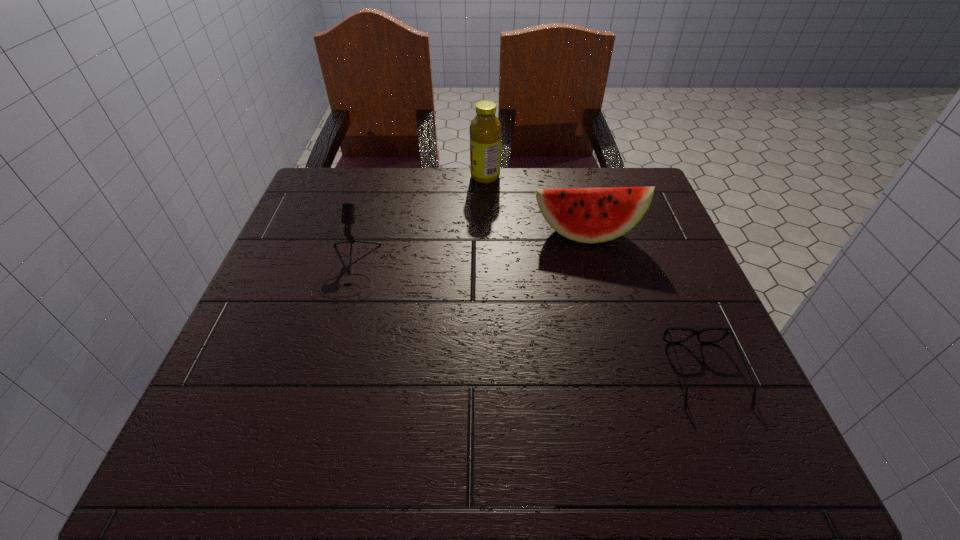
Locate an element on the screen. vacant area located on the outer rind of the watermelon is located at coordinates (599, 285).

I want to click on vacant space positioned 0.240m on the stand of the leftmost object, so click(305, 411).

Where is `vacant space located with the lenses facing outward on the shortest object`? vacant space located with the lenses facing outward on the shortest object is located at coordinates (733, 447).

Where is `object that is at the far edge`? This screenshot has width=960, height=540. object that is at the far edge is located at coordinates (485, 131).

Where is `object present at the left edge`? object present at the left edge is located at coordinates (348, 209).

Where is `watermelon at the right edge`? The image size is (960, 540). watermelon at the right edge is located at coordinates (588, 215).

Identify the location of spectacles present at the right edge. This screenshot has height=540, width=960. (728, 330).

In the image, there is a desktop. Identify the location of vacant space at the far edge. (515, 190).

This screenshot has width=960, height=540. I want to click on vacant space at the near edge of the desktop, so click(453, 424).

I want to click on vacant position at the left edge of the desktop, so click(x=243, y=409).